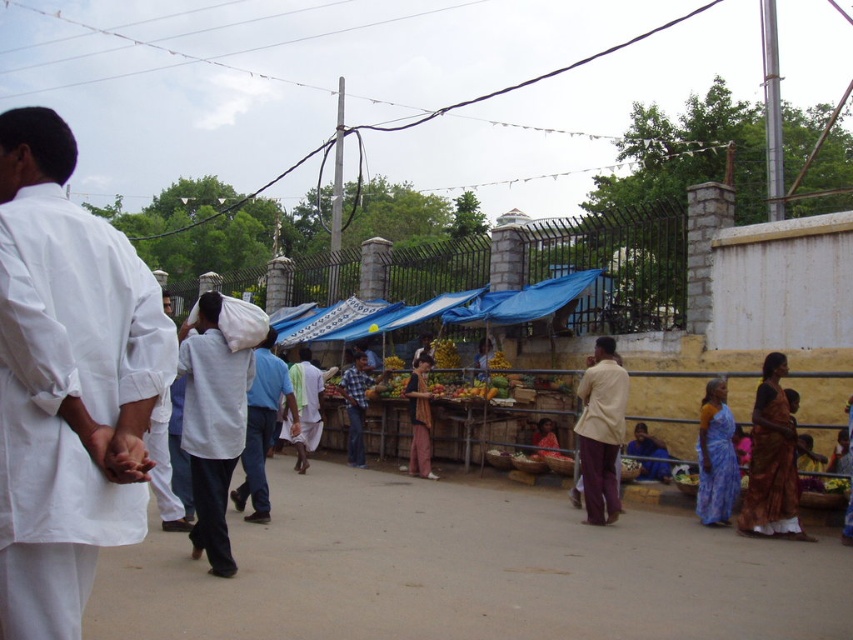
Based on the photo, you are a photographer trying to capture the vibrant colors of the market. You notice the shiny gold saree at lower right and the checkered fabric shirt at center. Which of these items has a narrower width?

The shiny gold saree at lower right has a lesser width compared to the checkered fabric shirt at center.

You are a photographer standing in the market and want to capture both the shiny gold saree at lower right and the checkered fabric shirt at center in a single photo. Which object should you focus on first to ensure both are in clear view?

You should focus on the shiny gold saree at lower right first because it is closer to the viewer than the checkered fabric shirt at center, ensuring both will be in focus when focused on the closer object.